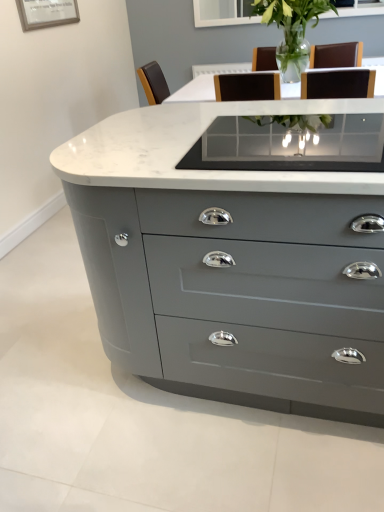
Question: In the image, is clear glass table at center on the left side or the right side of matte gray chest of drawers at center?

Choices:
 (A) right
 (B) left

Answer: (A)

Question: From the image's perspective, is clear glass table at center above or below matte gray chest of drawers at center?

Choices:
 (A) below
 (B) above

Answer: (B)

Question: Considering the real-world distances, which object is closest to the clear glass vase at center?

Choices:
 (A) clear glass table at center
 (B) matte gray chest of drawers at center

Answer: (A)

Question: Which object is positioned farthest from the clear glass vase at center?

Choices:
 (A) matte gray chest of drawers at center
 (B) clear glass table at center

Answer: (A)